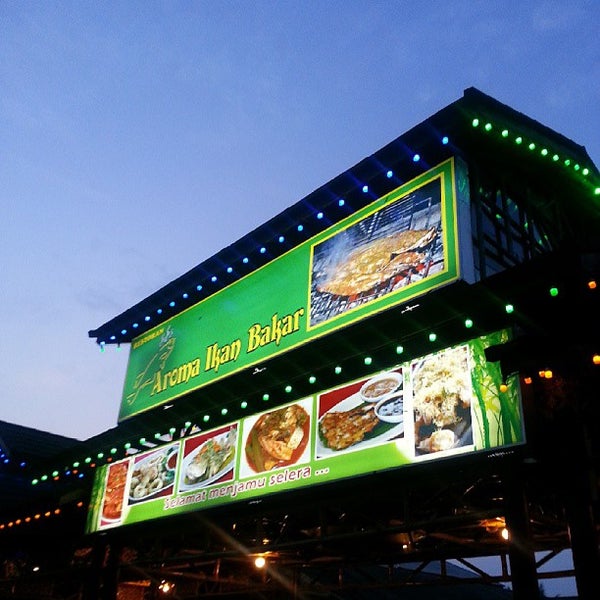
Where is `pillar`? The width and height of the screenshot is (600, 600). pillar is located at coordinates (519, 567), (572, 561).